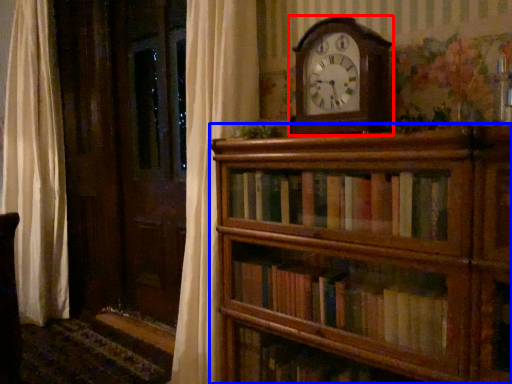
Question: Among these objects, which one is farthest to the camera, wall clock (highlighted by a red box) or shelf (highlighted by a blue box)?

Choices:
 (A) wall clock
 (B) shelf

Answer: (A)